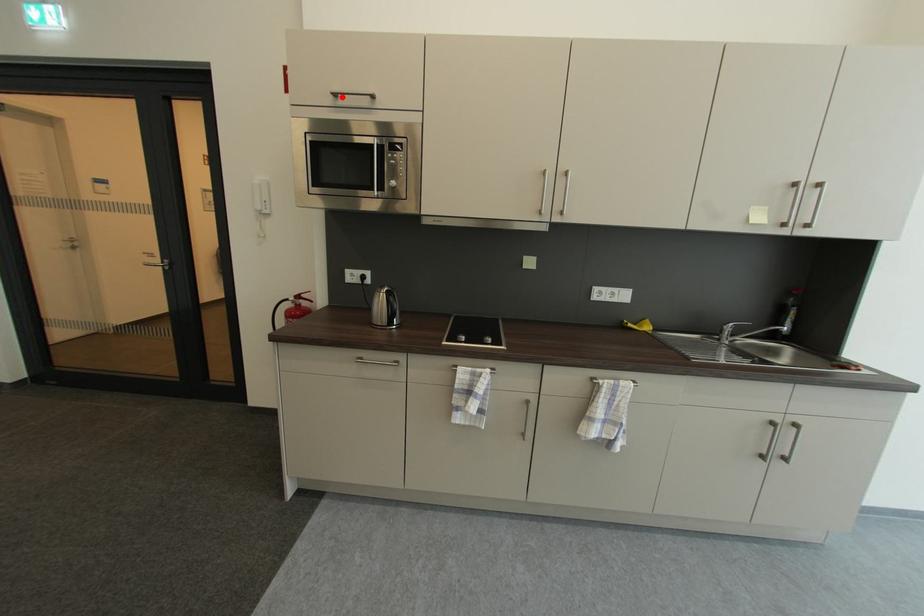
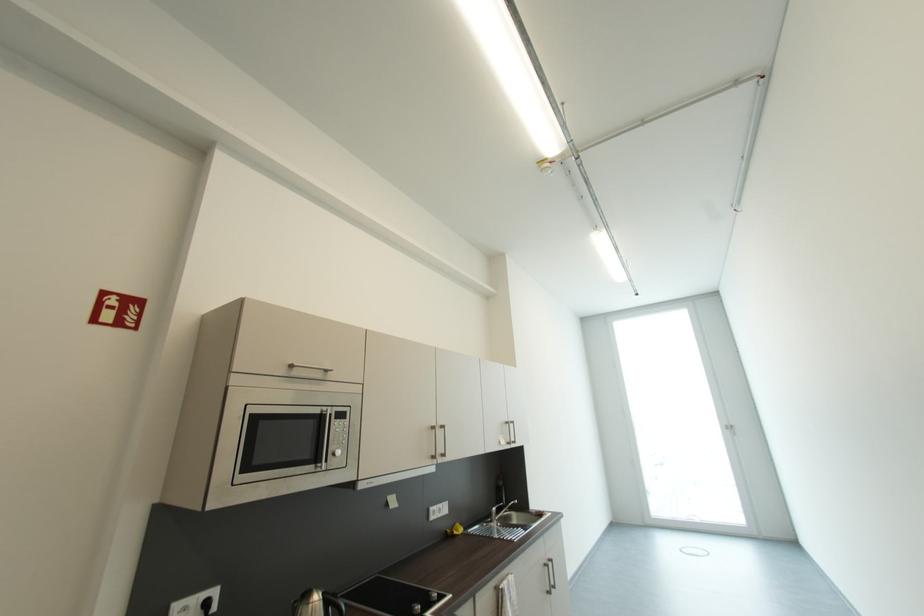
In the second image, find the point that corresponds to the highlighted location in the first image.

(298, 368)